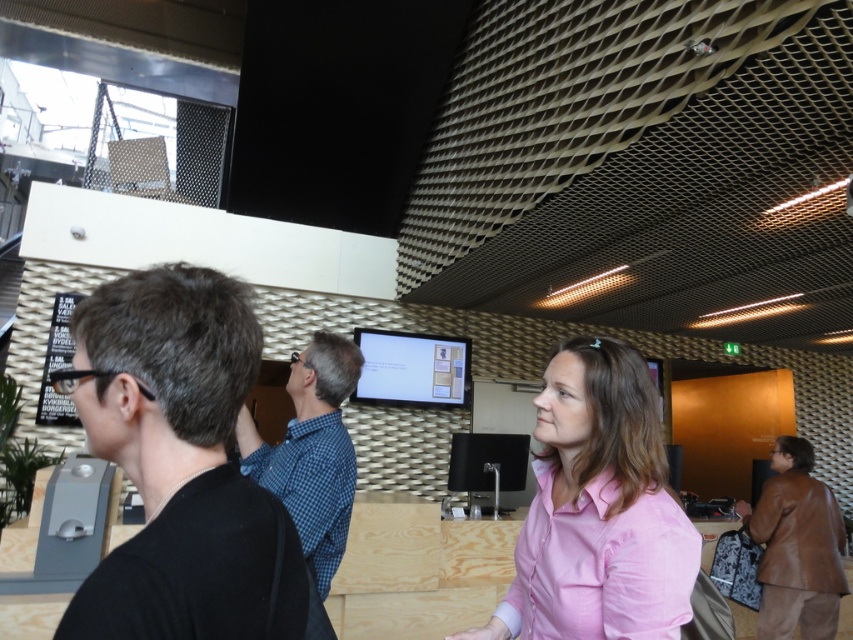
Is pink fabric shirt at center shorter than blue checkered shirt at center?

Yes, pink fabric shirt at center is shorter than blue checkered shirt at center.

Where is `pink fabric shirt at center`? Image resolution: width=853 pixels, height=640 pixels. pink fabric shirt at center is located at coordinates (598, 509).

Which is behind, point (567, 541) or point (815, 611)?

The point (815, 611) is behind.

Which of these two, pink fabric shirt at center or brown leather jacket at lower right, stands shorter?

With less height is pink fabric shirt at center.

Is point (643, 493) positioned behind point (764, 556)?

That is False.

Where is `pink fabric shirt at center`? The image size is (853, 640). pink fabric shirt at center is located at coordinates coord(598,509).

From the picture: Is pink fabric shirt at center below matte white monitor at center?

Yes, pink fabric shirt at center is below matte white monitor at center.

Looking at this image, is pink fabric shirt at center to the left of matte white monitor at center from the viewer's perspective?

In fact, pink fabric shirt at center is to the right of matte white monitor at center.

Does point (624, 602) come closer to viewer compared to point (431, 371)?

Yes, it is in front of point (431, 371).

Locate an element on the screen. The height and width of the screenshot is (640, 853). pink fabric shirt at center is located at coordinates (598, 509).